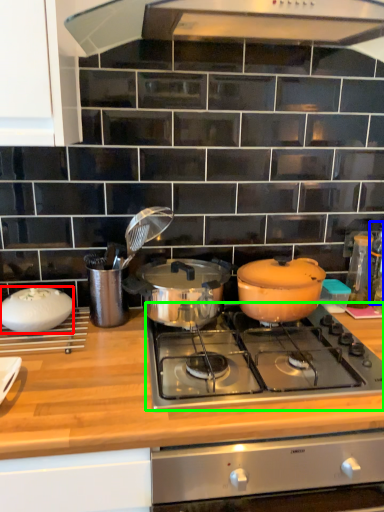
Question: Estimate the real-world distances between objects in this image. Which object is farther from kitchen appliance (highlighted by a red box), bottle (highlighted by a blue box) or gas stove (highlighted by a green box)?

Choices:
 (A) bottle
 (B) gas stove

Answer: (A)